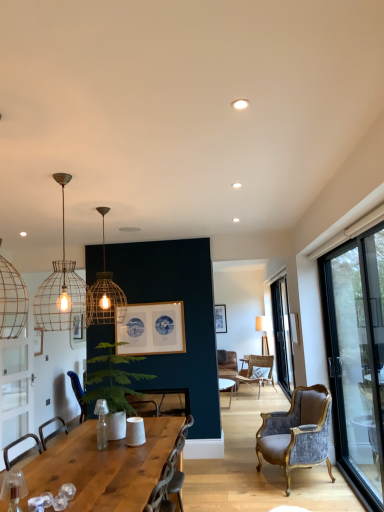
Image resolution: width=384 pixels, height=512 pixels. Describe the element at coordinates (240, 104) in the screenshot. I see `white matte recessed light at upper center` at that location.

Measure the distance between point (351, 325) and camera.

4.51 meters.

Identify the location of rattan chair at center, which is the 1th chair from back to front. This screenshot has width=384, height=512. (258, 371).

Where is `matte wooden picture frame at upper center, the 1th picture frame positioned from the back`? The image size is (384, 512). matte wooden picture frame at upper center, the 1th picture frame positioned from the back is located at coordinates click(77, 331).

The height and width of the screenshot is (512, 384). Find the location of `wooden framed picture at center, the 1th picture frame from the right`. wooden framed picture at center, the 1th picture frame from the right is located at coordinates (151, 329).

In order to face transparent glass door at right, which is the second window in front-to-back order, should I rotate leftwards or rightwards?

To align with it, rotate right about 12.194°.

I want to click on white matte recessed light at upper center, so click(240, 104).

From a real-world perspective, is metal wire pendant light at upper left, positioned as the second lamp in back-to-front order, beneath matte gold wire cage pendant light at upper center, which is the first lamp from back to front?

Yes, from a real-world perspective, metal wire pendant light at upper left, positioned as the second lamp in back-to-front order, is under matte gold wire cage pendant light at upper center, which is the first lamp from back to front.

Is metal wire pendant light at upper left, marked as the first lamp in a front-to-back arrangement, wider than matte gold wire cage pendant light at upper center, which is the first lamp from back to front?

Yes, metal wire pendant light at upper left, marked as the first lamp in a front-to-back arrangement, is wider than matte gold wire cage pendant light at upper center, which is the first lamp from back to front.

Can you tell me how much metal wire pendant light at upper left, marked as the first lamp in a front-to-back arrangement, and matte gold wire cage pendant light at upper center, acting as the second lamp starting from the front, differ in facing direction?

There is a 0.000743-degree angle between the facing directions of metal wire pendant light at upper left, marked as the first lamp in a front-to-back arrangement, and matte gold wire cage pendant light at upper center, acting as the second lamp starting from the front.

Can you confirm if metal wire pendant light at upper left, positioned as the second lamp in back-to-front order, is shorter than matte gold wire cage pendant light at upper center, which is the first lamp from back to front?

No.

Which object is thinner, wooden table at center or white matte recessed light at upper center?

Thinner between the two is white matte recessed light at upper center.

Is wooden table at center beside white matte recessed light at upper center?

No, wooden table at center is not beside white matte recessed light at upper center.

Between wooden table at center and white matte recessed light at upper center, which one is positioned behind?

wooden table at center is more distant.

Which object is positioned more to the left, wooden table at center or white matte recessed light at upper center?

wooden table at center.

Is green leafy plant at center to the left of wooden framed picture at center, placed as the 2th picture frame when sorted from left to right, from the viewer's perspective?

Indeed, green leafy plant at center is positioned on the left side of wooden framed picture at center, placed as the 2th picture frame when sorted from left to right.

Which is in front, point (101, 349) or point (143, 343)?

The point (101, 349) is closer to the camera.

Which picture frame is the 1st one when counting from the back of the green leafy plant at center? Please provide its 2D coordinates.

[(151, 329)]

Is green leafy plant at center oriented towards wooden framed picture at center, which is the second picture frame from back to front?

No, green leafy plant at center is not turned towards wooden framed picture at center, which is the second picture frame from back to front.

From a real-world perspective, relative to rattan chair at center, which appears as the 3th chair when viewed from the left, is metal wire pendant light at upper left, positioned as the second lamp in back-to-front order, vertically above or below?

From a real-world perspective, metal wire pendant light at upper left, positioned as the second lamp in back-to-front order, is physically above rattan chair at center, which appears as the 3th chair when viewed from the left.

Can you tell me how much metal wire pendant light at upper left, marked as the first lamp in a front-to-back arrangement, and rattan chair at center, which appears as the 3th chair when viewed from the left, differ in facing direction?

There is a 151-degree angle between the facing directions of metal wire pendant light at upper left, marked as the first lamp in a front-to-back arrangement, and rattan chair at center, which appears as the 3th chair when viewed from the left.

Is metal wire pendant light at upper left, positioned as the second lamp in back-to-front order, turned away from rattan chair at center, placed as the 1th chair when sorted from right to left?

No, metal wire pendant light at upper left, positioned as the second lamp in back-to-front order, is not facing away from rattan chair at center, placed as the 1th chair when sorted from right to left.

Is the surface of metal wire pendant light at upper left, marked as the first lamp in a front-to-back arrangement, in direct contact with rattan chair at center, which appears as the 3th chair when viewed from the left?

metal wire pendant light at upper left, marked as the first lamp in a front-to-back arrangement, and rattan chair at center, which appears as the 3th chair when viewed from the left, are clearly separated.

Is transparent glass door at right, which is the second window in front-to-back order, to the left or to the right of transparent glass door at right, positioned as the 2th window in back-to-front order, in the image?

transparent glass door at right, which is the second window in front-to-back order, is to the right of transparent glass door at right, positioned as the 2th window in back-to-front order.

Which is in front, point (284, 312) or point (334, 397)?

The point (334, 397) is more forward.

Is transparent glass door at right, which is counted as the second window, starting from the left, next to transparent glass door at right, which ranks as the first window in left-to-right order, and touching it?

No, transparent glass door at right, which is counted as the second window, starting from the left, is not touching transparent glass door at right, which ranks as the first window in left-to-right order.

Which is behind, transparent glass door at right, marked as the 1th window in a right-to-left arrangement, or transparent glass door at right, which ranks as the first window in left-to-right order?

transparent glass door at right, marked as the 1th window in a right-to-left arrangement, is further from the camera.

From their relative heights in the image, would you say transparent glass door at right, marked as the 1th window in a right-to-left arrangement, is taller or shorter than wooden chair at center, the 1th chair from the front?

Considering their sizes, transparent glass door at right, marked as the 1th window in a right-to-left arrangement, has more height than wooden chair at center, the 1th chair from the front.

Between point (283, 372) and point (181, 482), which one is positioned behind?

The point (283, 372) is behind.

Which is correct: transparent glass door at right, marked as the first window in a back-to-front arrangement, is inside wooden chair at center, the 1th chair from the front, or outside of it?

transparent glass door at right, marked as the first window in a back-to-front arrangement, is not inside wooden chair at center, the 1th chair from the front, it's outside.

Would you consider wooden chair at center, the first chair viewed from the left, to be distant from metal wire pendant light at upper left, marked as the first lamp in a front-to-back arrangement?

That's right, there is a large distance between wooden chair at center, the first chair viewed from the left, and metal wire pendant light at upper left, marked as the first lamp in a front-to-back arrangement.

Is wooden chair at center, which ranks as the third chair in right-to-left order, aimed at metal wire pendant light at upper left, marked as the first lamp in a front-to-back arrangement?

No, wooden chair at center, which ranks as the third chair in right-to-left order, is not turned towards metal wire pendant light at upper left, marked as the first lamp in a front-to-back arrangement.

Does point (159, 509) come behind point (65, 277)?

No, it is in front of (65, 277).

I want to click on lamp above the metal wire pendant light at upper left, marked as the first lamp in a front-to-back arrangement (from a real-world perspective), so click(x=104, y=293).

Find the location of a particular element. This screenshot has height=512, width=384. lighting lying on the right of wooden table at center is located at coordinates (240, 104).

From the image, which object appears to be farther from transparent glass door at right, the 2th window from the right, wooden chair at center, the first chair viewed from the left, or green leafy plant at center?

green leafy plant at center is further to transparent glass door at right, the 2th window from the right.

From the image, which object appears to be farther from rattan chair at center, which is the 1th chair from back to front, transparent glass door at right, which ranks as the first window in left-to-right order, or metal wire pendant light at upper left, positioned as the second lamp in back-to-front order?

metal wire pendant light at upper left, positioned as the second lamp in back-to-front order, lies further to rattan chair at center, which is the 1th chair from back to front, than the other object.

Looking at the image, which one is located closer to transparent glass door at right, the 2th window from the right, transparent glass door at right, marked as the first window in a back-to-front arrangement, or white matte recessed light at upper center?

transparent glass door at right, marked as the first window in a back-to-front arrangement.

Which object lies nearer to the anchor point matte gold wire cage pendant light at upper center, acting as the second lamp starting from the front, metal wire pendant light at upper left, positioned as the second lamp in back-to-front order, or rattan chair at center, which appears as the 3th chair when viewed from the left?

Among the two, metal wire pendant light at upper left, positioned as the second lamp in back-to-front order, is located nearer to matte gold wire cage pendant light at upper center, acting as the second lamp starting from the front.

From the image, which object appears to be farther from transparent glass door at right, positioned as the 2th window in back-to-front order, white matte recessed light at upper center or metal wire pendant light at upper left, marked as the first lamp in a front-to-back arrangement?

white matte recessed light at upper center.

Considering their positions, is wooden table at center positioned further to wooden framed picture at center, the 1th picture frame from the right, than green leafy plant at center?

wooden table at center is positioned further to the anchor wooden framed picture at center, the 1th picture frame from the right.

Looking at the image, which one is located closer to matte gold wire cage pendant light at upper center, acting as the second lamp starting from the front, transparent glass door at right, which is counted as the second window, starting from the left, or white matte recessed light at upper center?

Based on the image, white matte recessed light at upper center appears to be nearer to matte gold wire cage pendant light at upper center, acting as the second lamp starting from the front.

From the picture: Looking at the image, which one is located closer to matte gold wire cage pendant light at upper center, which is the first lamp from back to front, matte wooden picture frame at upper center, which is the 2th picture frame in front-to-back order, or wooden table at center?

matte wooden picture frame at upper center, which is the 2th picture frame in front-to-back order, is positioned closer to the anchor matte gold wire cage pendant light at upper center, which is the first lamp from back to front.

Find the location of `picture frame located between matte wooden picture frame at upper center, placed as the 2th picture frame when sorted from right to left, and transparent glass door at right, which is the second window in front-to-back order, in the left-right direction`. picture frame located between matte wooden picture frame at upper center, placed as the 2th picture frame when sorted from right to left, and transparent glass door at right, which is the second window in front-to-back order, in the left-right direction is located at coordinates (151, 329).

The height and width of the screenshot is (512, 384). I want to click on table between matte gold wire cage pendant light at upper center, acting as the second lamp starting from the front, and transparent glass door at right, the 2th window from the right, so click(104, 467).

Locate an element on the screen. houseplant between wooden table at center and velvet grey chair at right, the 2th chair positioned from the left, in the front-back direction is located at coordinates (113, 387).

The image size is (384, 512). I want to click on table between white matte recessed light at upper center and transparent glass door at right, which is the second window in front-to-back order, in the front-back direction, so click(x=104, y=467).